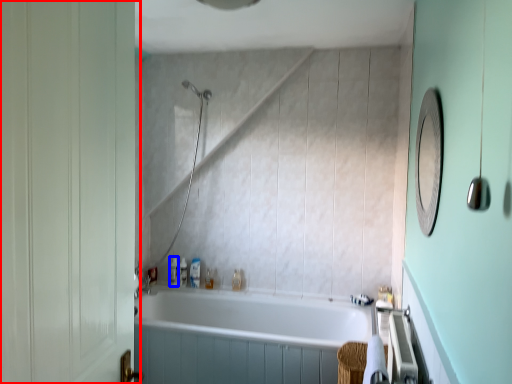
Question: Which object is closer to the camera taking this photo, screen door (highlighted by a red box) or toiletry (highlighted by a blue box)?

Choices:
 (A) screen door
 (B) toiletry

Answer: (A)